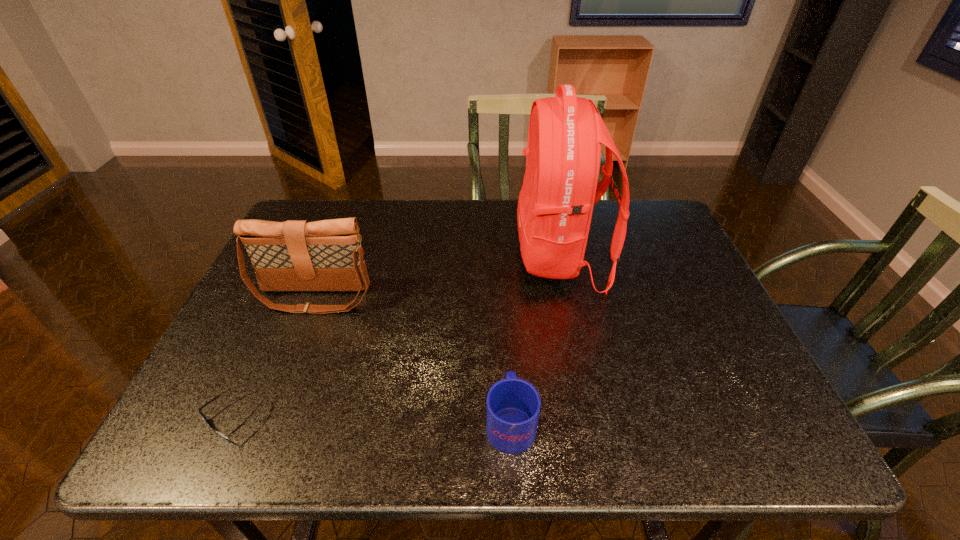
The image size is (960, 540). In the image, there is a desktop. Find the location of `vacant space at the right edge`. vacant space at the right edge is located at coordinates (708, 344).

The width and height of the screenshot is (960, 540). What are the coordinates of `free space at the far right corner of the desktop` in the screenshot? It's located at (659, 219).

Where is `free space between the backpack and the shoulder bag`? This screenshot has height=540, width=960. free space between the backpack and the shoulder bag is located at coordinates (438, 276).

You are a GUI agent. You are given a task and a screenshot of the screen. Output one action in this format:
    pyautogui.click(x=<x>, y=<y>)
    Task: Click on the free space between the tallest object and the third tallest object
    Image resolution: width=960 pixels, height=540 pixels.
    Given the screenshot: What is the action you would take?
    pyautogui.click(x=536, y=339)

Find the location of a particular element. This screenshot has width=960, height=540. free spot between the sunglasses and the backpack is located at coordinates (396, 336).

You are a GUI agent. You are given a task and a screenshot of the screen. Output one action in this format:
    pyautogui.click(x=<x>, y=<y>)
    Task: Click on the vacant area between the mug and the shortest object
    Image resolution: width=960 pixels, height=540 pixels.
    Given the screenshot: What is the action you would take?
    pyautogui.click(x=372, y=418)

The width and height of the screenshot is (960, 540). What are the coordinates of `unoccupied position between the third shortest object and the tallest object` in the screenshot? It's located at (438, 276).

Find the location of a particular element. This screenshot has width=960, height=540. free space between the shoulder bag and the third tallest object is located at coordinates (413, 359).

Where is `empty space between the second shortest object and the backpack`? The width and height of the screenshot is (960, 540). empty space between the second shortest object and the backpack is located at coordinates (536, 339).

The width and height of the screenshot is (960, 540). Identify the location of free spot between the second shortest object and the sunglasses. (372, 418).